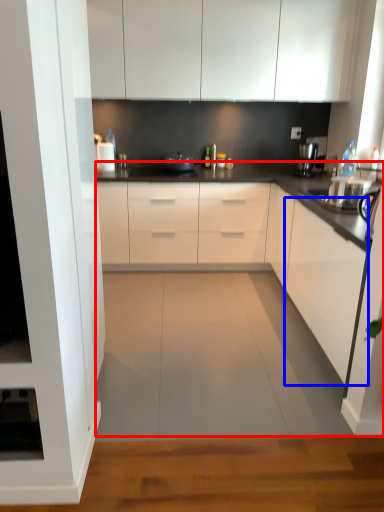
Question: Which object is further to the camera taking this photo, countertop (highlighted by a red box) or cabinetry (highlighted by a blue box)?

Choices:
 (A) countertop
 (B) cabinetry

Answer: (B)